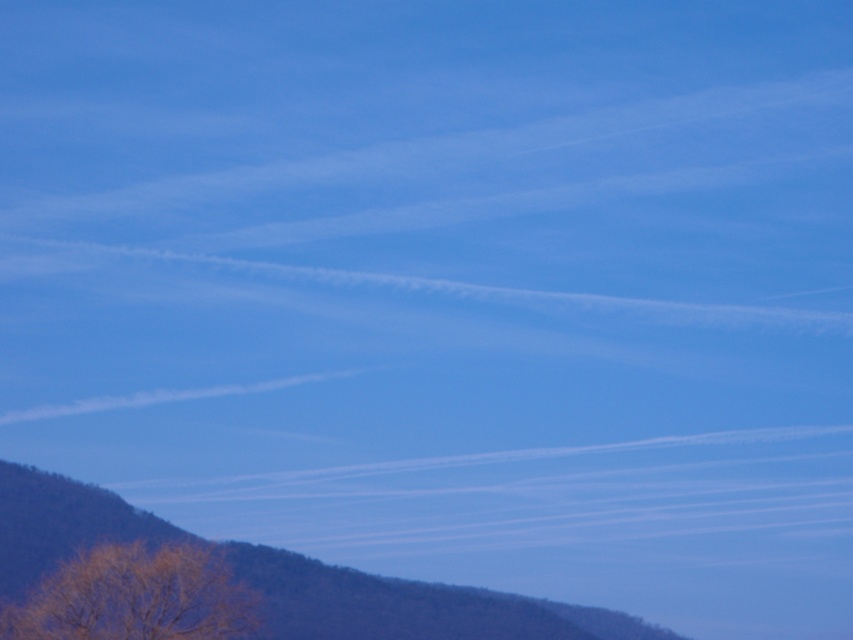
You are an astronomer analyzing the sky in the image. You notice two points marked as point 1 at coordinates (41, 490) and point 2 at (51, 604). Based on their positions, which point is closer to the horizon?

Point 1 at coordinates (41, 490) is behind point 2 at (51, 604), so point 2 is closer to the horizon.

You are a hiker standing at the base of the brown textured mountain at lower left and the brown textured tree at lower left. Which object is taller?

The brown textured mountain at lower left is taller than the brown textured tree at lower left.

You are standing in the landscape and see the brown textured mountain at lower left and the brown textured tree at lower left. Which one is positioned more to the left?

The brown textured tree at lower left is more to the left because the brown textured mountain at lower left is to its right.